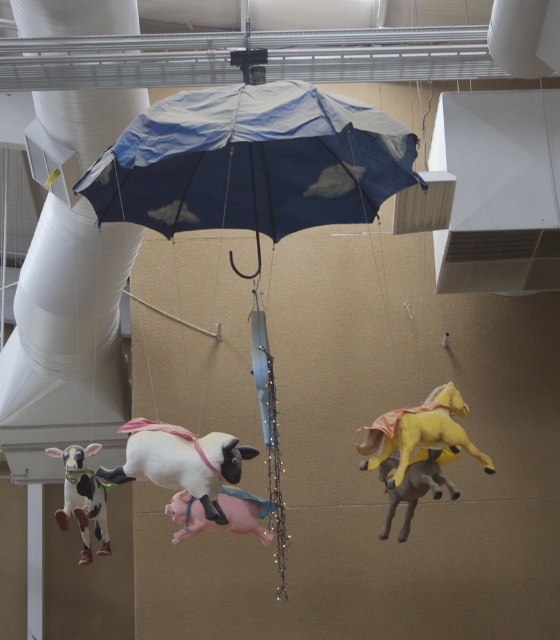
Does white and black spotted plastic cow at lower left have a larger size compared to rubber horse at center?

Yes.

Which is more to the right, white and black spotted plastic cow at lower left or rubber horse at center?

Positioned to the right is rubber horse at center.

Which is in front, point (59, 456) or point (404, 524)?

Point (404, 524)

This screenshot has height=640, width=560. What are the coordinates of `white and black spotted plastic cow at lower left` in the screenshot? It's located at (84, 497).

Does blue fabric umbrella at center have a lesser height compared to white and black spotted plastic cow at lower left?

Yes, blue fabric umbrella at center is shorter than white and black spotted plastic cow at lower left.

Does blue fabric umbrella at center have a greater width compared to white and black spotted plastic cow at lower left?

Indeed, blue fabric umbrella at center has a greater width compared to white and black spotted plastic cow at lower left.

Does point (297, 168) come behind point (95, 448)?

No, (297, 168) is in front of (95, 448).

Find the location of a particular element. blue fabric umbrella at center is located at coordinates (252, 163).

Does yellow matte horse at center lie in front of rubber horse at center?

That is False.

Does yellow matte horse at center have a greater width compared to rubber horse at center?

Yes.

Describe the element at coordinates (420, 432) in the screenshot. I see `yellow matte horse at center` at that location.

Identify the location of yellow matte horse at center. Image resolution: width=560 pixels, height=640 pixels. (420, 432).